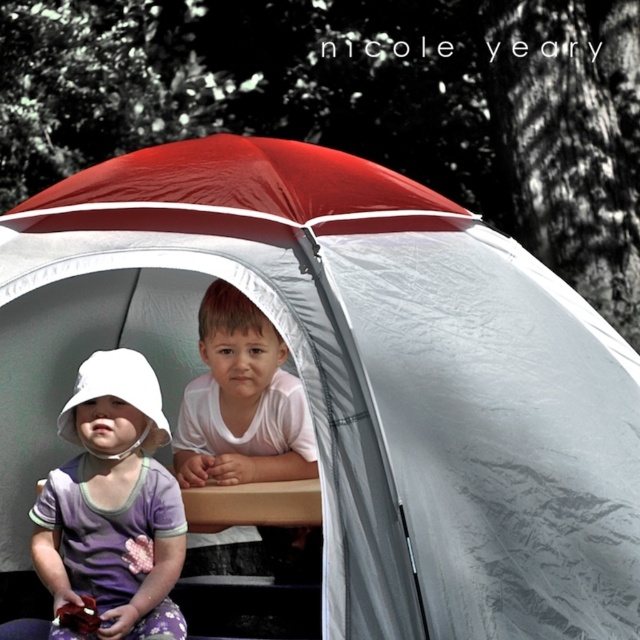
You are a photographer setting up a camera to take a portrait of the purple cotton dress at lower left and the white matte shirt at center. The camera has a minimum focusing distance of 20 inches. Will you need to adjust the camera position to ensure both subjects are in focus?

The purple cotton dress at lower left and white matte shirt at center are 21.42 inches apart from each other. Since the minimum focusing distance is 20 inches, the camera can focus on both subjects without needing adjustment as the distance between them is within the required range.

You are a photographer setting up a photo shoot inside the tent. You want to ensure both the purple cotton dress at lower left and the white matte shirt at center are visible in the frame. Given their height difference, which clothing item might require you to adjust the camera angle to capture both properly?

The purple cotton dress at lower left has a greater height compared to the white matte shirt at center. To capture both properly, you might need to lower the camera angle slightly to ensure the taller purple cotton dress at lower left doesn not block the view of the shorter white matte shirt at center.

You are standing outside the tent and want to locate the purple cotton dress at lower left. Based on the coordinates provided, where should you look relative to the tent?

The purple cotton dress at lower left is located at the coordinates point (113, 502), which would be in the lower left area of the tent.